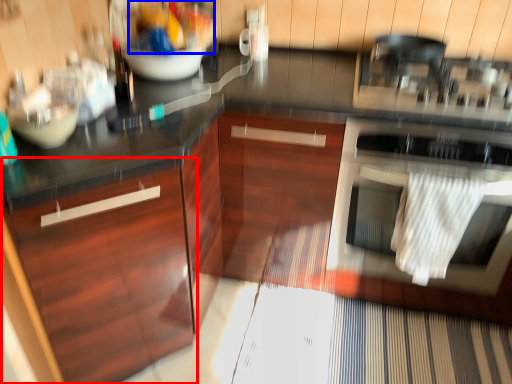
Question: Which object appears farthest to the camera in this image, cabinetry (highlighted by a red box) or food (highlighted by a blue box)?

Choices:
 (A) cabinetry
 (B) food

Answer: (B)